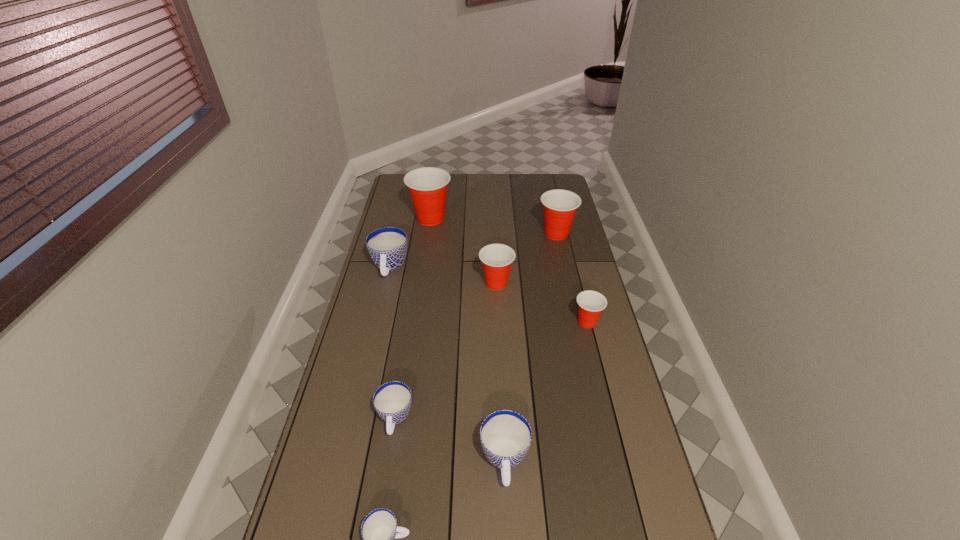
The image size is (960, 540). What are the coordinates of `object that is the closest one to the smallest red cup` in the screenshot? It's located at (496, 258).

At what (x,y) coordinates should I click in order to perform the action: click on object that ranks as the second closest to the rightmost blue cup. Please return your answer as a coordinate pair (x, y). Looking at the image, I should click on coord(392,401).

Identify which cup is the second nearest to the smallest red cup. Please provide its 2D coordinates. Your answer should be formatted as a tuple, i.e. [(x, y)], where the tuple contains the x and y coordinates of a point satisfying the conditions above.

[(560, 206)]

Select which cup appears as the seventh closest to the second smallest red cup. Please provide its 2D coordinates. Your answer should be formatted as a tuple, i.e. [(x, y)], where the tuple contains the x and y coordinates of a point satisfying the conditions above.

[(379, 529)]

Identify which red cup is the third nearest to the nearest red cup. Please provide its 2D coordinates. Your answer should be formatted as a tuple, i.e. [(x, y)], where the tuple contains the x and y coordinates of a point satisfying the conditions above.

[(427, 186)]

Where is `red cup identified as the closest to the third biggest red cup`? This screenshot has height=540, width=960. red cup identified as the closest to the third biggest red cup is located at coordinates (590, 303).

Identify which blue cup is the nearest to the biggest blue cup. Please provide its 2D coordinates. Your answer should be formatted as a tuple, i.e. [(x, y)], where the tuple contains the x and y coordinates of a point satisfying the conditions above.

[(392, 401)]

Choose which blue cup is the third nearest neighbor to the seventh tallest object. Please provide its 2D coordinates. Your answer should be formatted as a tuple, i.e. [(x, y)], where the tuple contains the x and y coordinates of a point satisfying the conditions above.

[(387, 246)]

This screenshot has height=540, width=960. Find the location of `free spot that satisfies the following two spatial constraints: 1. on the back side of the third farthest red cup; 2. on the right side of the seventh shortest object`. free spot that satisfies the following two spatial constraints: 1. on the back side of the third farthest red cup; 2. on the right side of the seventh shortest object is located at coordinates (494, 234).

In order to click on vacant space that satisfies the following two spatial constraints: 1. on the side of the farthest blue cup with the handle; 2. on the left side of the smallest red cup in this screenshot , I will do `click(376, 322)`.